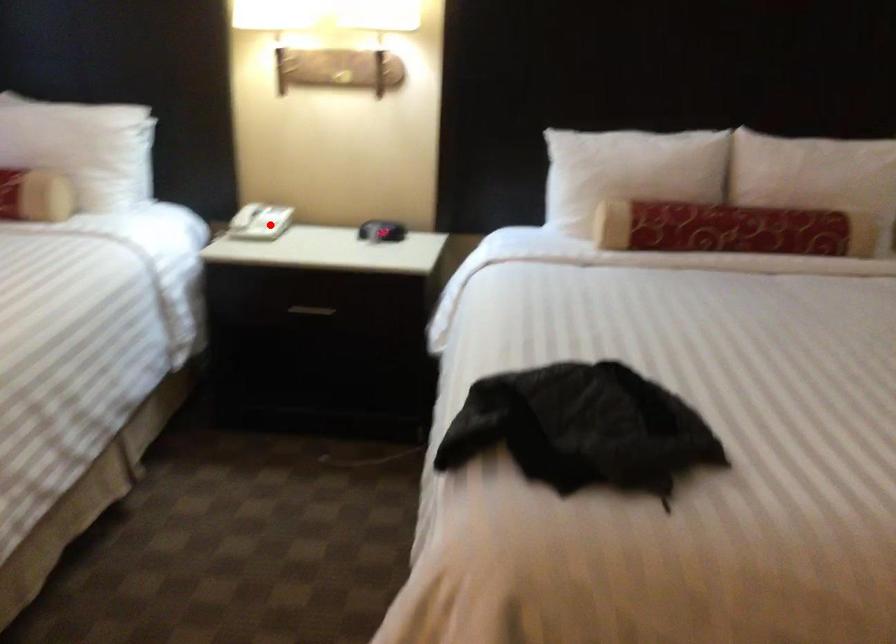
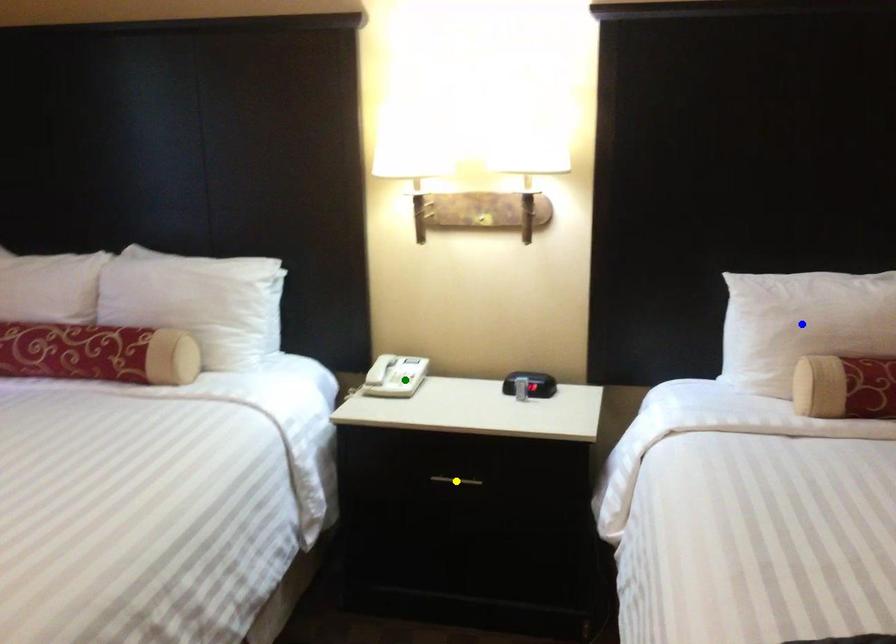
Question: I am providing you with two images of the same scene from different viewpoints. A red point is marked on the first image. You are given multiple points on the second image. Which spot in image 2 lines up with the point in image 1?

Choices:
 (A) blue point
 (B) yellow point
 (C) green point

Answer: (C)